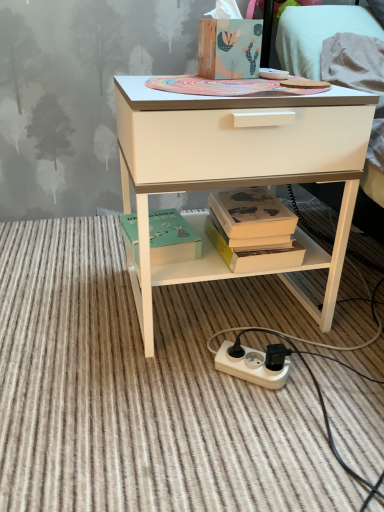
In order to click on vacant area that lies between white matte desk at center and white plastic power outlet at lower center in this screenshot , I will do `click(245, 384)`.